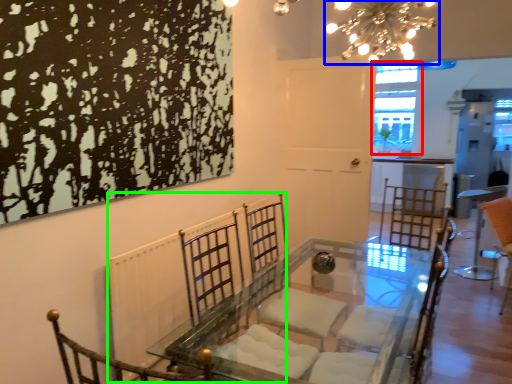
Question: Based on their relative distances, which object is nearer to window (highlighted by a red box)? Choose from light fixture (highlighted by a blue box) and radiator (highlighted by a green box).

Choices:
 (A) light fixture
 (B) radiator

Answer: (A)